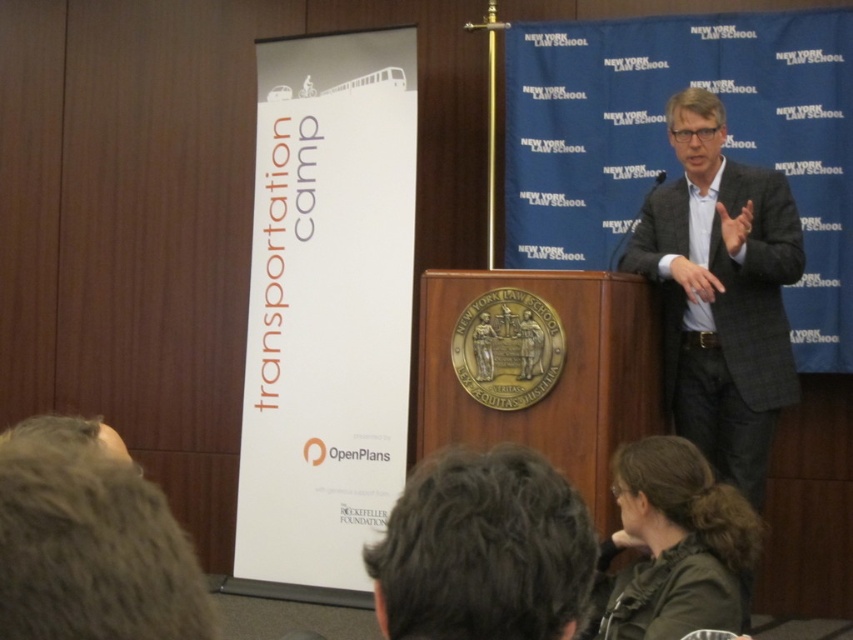
Is point (689, 340) behind point (639, 483)?

Yes, it is.

At what (x,y) coordinates should I click in order to perform the action: click on gray woolen suit at upper right. Please return your answer as a coordinate pair (x, y). The width and height of the screenshot is (853, 640). Looking at the image, I should click on (721, 292).